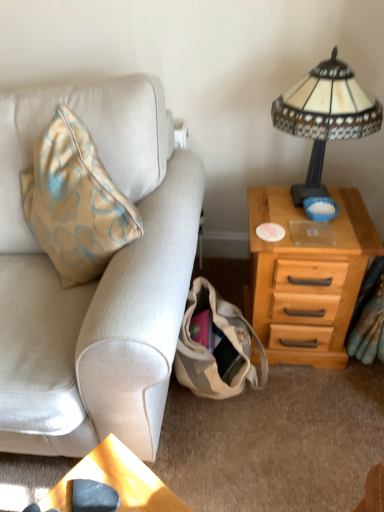
Question: Is stained glass lampshade at upper right positioned with its back to beige canvas bag at lower center?

Choices:
 (A) yes
 (B) no

Answer: (B)

Question: Can you confirm if stained glass lampshade at upper right is positioned to the right of beige canvas bag at lower center?

Choices:
 (A) yes
 (B) no

Answer: (A)

Question: Can beige canvas bag at lower center be found inside stained glass lampshade at upper right?

Choices:
 (A) no
 (B) yes

Answer: (A)

Question: Can you confirm if stained glass lampshade at upper right is thinner than beige canvas bag at lower center?

Choices:
 (A) yes
 (B) no

Answer: (A)

Question: From a real-world perspective, is stained glass lampshade at upper right physically below beige canvas bag at lower center?

Choices:
 (A) yes
 (B) no

Answer: (B)

Question: Is stained glass lampshade at upper right positioned behind beige canvas bag at lower center?

Choices:
 (A) no
 (B) yes

Answer: (A)

Question: Does beige canvas bag at lower center have a larger size compared to wooden nightstand at right?

Choices:
 (A) no
 (B) yes

Answer: (A)

Question: Is beige canvas bag at lower center far away from wooden nightstand at right?

Choices:
 (A) no
 (B) yes

Answer: (A)

Question: Is wooden nightstand at right inside beige canvas bag at lower center?

Choices:
 (A) yes
 (B) no

Answer: (B)

Question: Does beige canvas bag at lower center come in front of wooden nightstand at right?

Choices:
 (A) no
 (B) yes

Answer: (B)

Question: Considering the relative positions of beige canvas bag at lower center and wooden nightstand at right in the image provided, is beige canvas bag at lower center to the left of wooden nightstand at right from the viewer's perspective?

Choices:
 (A) yes
 (B) no

Answer: (A)

Question: From the image's perspective, is beige canvas bag at lower center located beneath wooden nightstand at right?

Choices:
 (A) yes
 (B) no

Answer: (A)

Question: Does wooden nightstand at right turn towards beige fabric couch at left?

Choices:
 (A) no
 (B) yes

Answer: (A)